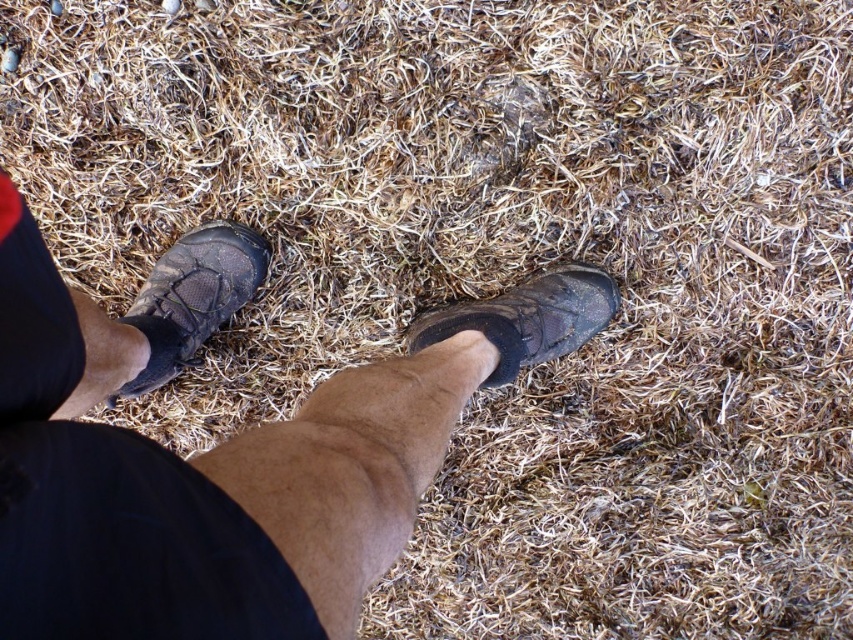
You are a hiker who needs to choose between your matte black shoe at left and leather boot at center for a trail that requires footwear with a larger size. Based on the scene, which one should you choose?

The leather boot at center is larger than the matte black shoe at left, so you should choose the leather boot at center for the trail that requires larger footwear.

You are a photographer trying to capture a detailed shot of the hiking shoes. You notice two points on the surface of the dry, straw material. One is at point (173, 252) and the other at point (585, 269). Which point should you focus on to ensure the shoes are in sharp focus?

You should focus on point (173, 252) because it is closer to the camera than point (585, 269), ensuring the shoes will be in sharp focus.